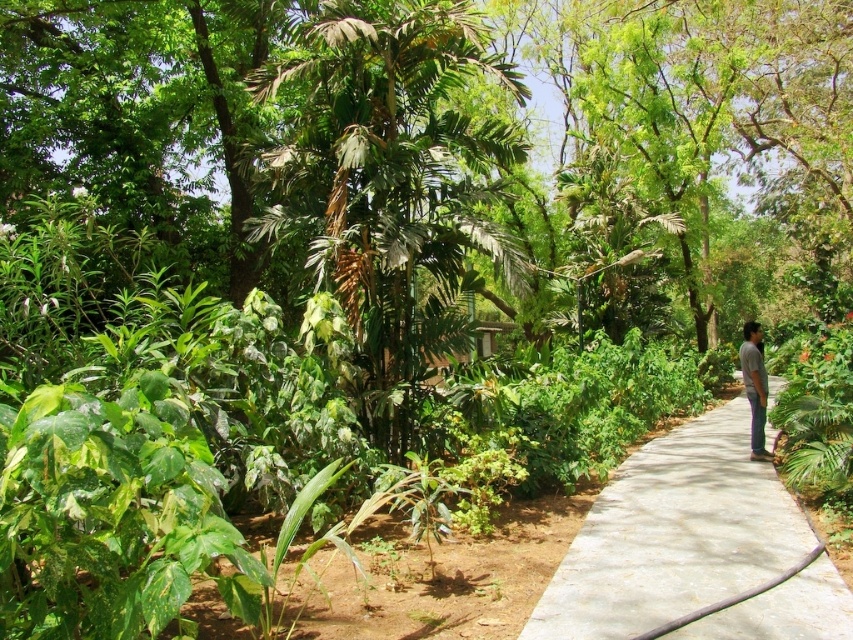
This screenshot has width=853, height=640. Describe the element at coordinates (672, 534) in the screenshot. I see `gray concrete pavement at center` at that location.

How much distance is there between gray concrete pavement at center and gray cotton shirt at right?

They are 2.30 meters apart.

What do you see at coordinates (672, 534) in the screenshot? I see `gray concrete pavement at center` at bounding box center [672, 534].

Where is `gray concrete pavement at center`? gray concrete pavement at center is located at coordinates (672, 534).

Is green leafy tree at center smaller than gray cotton shirt at right?

Indeed, green leafy tree at center has a smaller size compared to gray cotton shirt at right.

The image size is (853, 640). Describe the element at coordinates (387, 182) in the screenshot. I see `green leafy tree at center` at that location.

At what (x,y) coordinates should I click in order to perform the action: click on green leafy tree at center. Please return your answer as a coordinate pair (x, y). The height and width of the screenshot is (640, 853). Looking at the image, I should click on (387, 182).

Which is behind, point (479, 154) or point (599, 634)?

Positioned behind is point (479, 154).

Is point (416, 204) positioned after point (627, 502)?

Yes, it is.

You are a GUI agent. You are given a task and a screenshot of the screen. Output one action in this format:
    pyautogui.click(x=<x>, y=<y>)
    Task: Click on the green leafy tree at center
    The width and height of the screenshot is (853, 640).
    Given the screenshot: What is the action you would take?
    pyautogui.click(x=387, y=182)